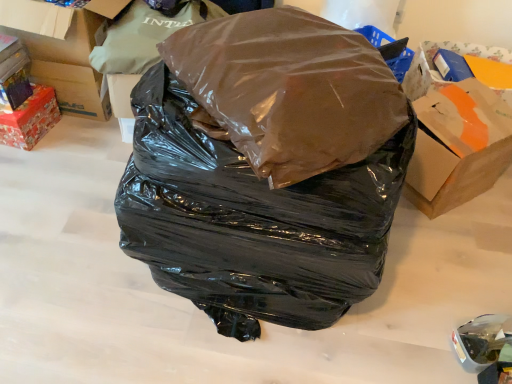
Find the location of a particular element. free space on the front side of brown cardboard box at right is located at coordinates (457, 249).